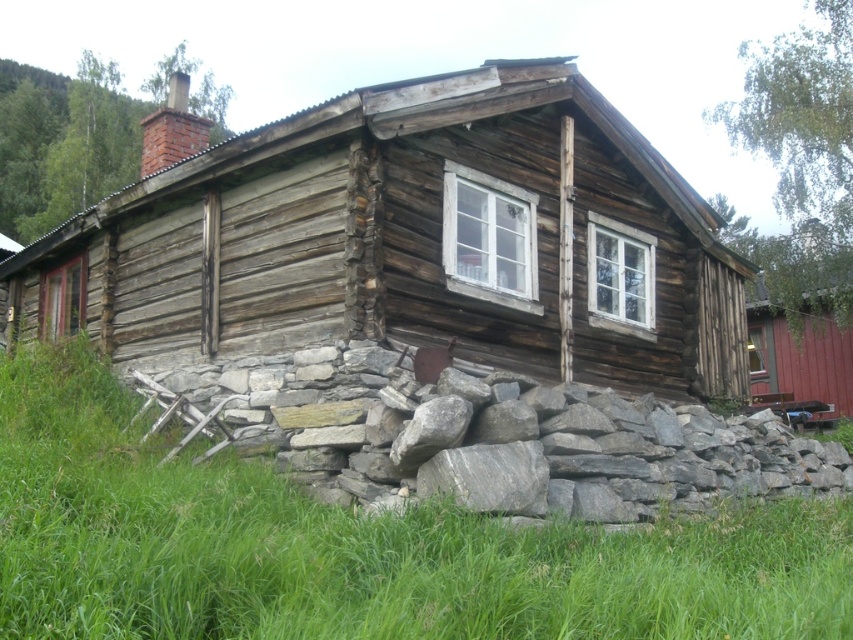
You are standing on the green grass at lower center and looking up at the weathered wood cabin at center. Which direction should you face to see the chimney on the roof?

The weathered wood cabin at center is located above green grass at lower center, so you should look upward to see the chimney on the roof.

You are standing in a natural setting and see the weathered wood cabin at center and the green grass at lower center. Which object is located to the right of the other?

The green grass at lower center is located to the right of the weathered wood cabin at center.

You are standing at a point where you want to take a photo of the weathered wood cabin at center. If your camera has a maximum focus range of 40 feet, will you be able to capture the cabin clearly?

The weathered wood cabin at center and camera are 40.12 feet apart from each other. Since the distance exceeds the camera maximum focus range of 40 feet, you will not be able to capture the cabin clearly.